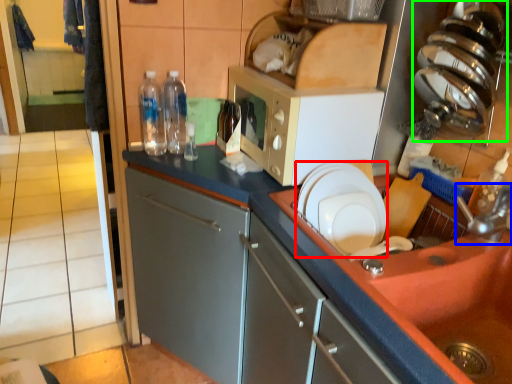
Question: Considering the real-world distances, which object is closest to plate (highlighted by a red box)? faucet (highlighted by a blue box) or appliance (highlighted by a green box).

Choices:
 (A) faucet
 (B) appliance

Answer: (A)